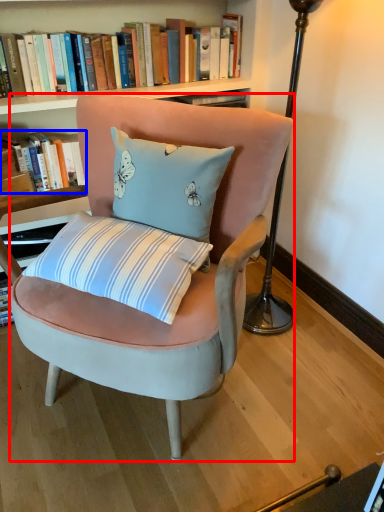
Question: Which object is further to the camera taking this photo, chair (highlighted by a red box) or book (highlighted by a blue box)?

Choices:
 (A) chair
 (B) book

Answer: (B)